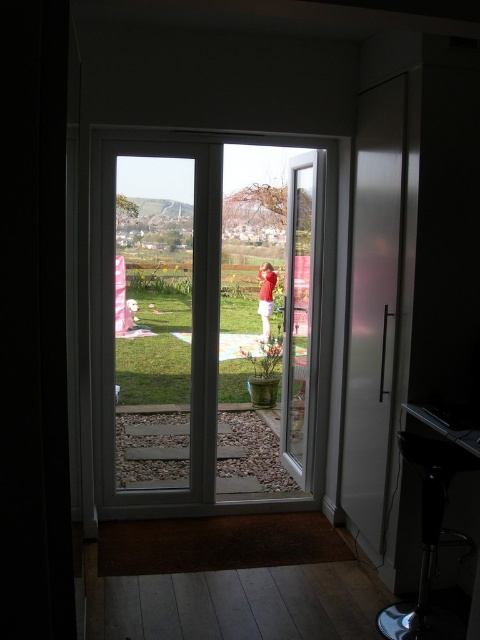
You are standing in the room and want to exit through the transparent glass door at center. Based on the 2D coordinates provided, where should you walk towards to exit?

You should walk towards the point at coordinates (210, 323) where the transparent glass door at center is located to exit.

You are standing at the entrance of the garden and want to move towards the point marked as point (260, 314). Which direction should you move relative to point (357, 145)?

You should move behind point (357, 145) to reach point (260, 314) because point (260, 314) is behind point (357, 145).